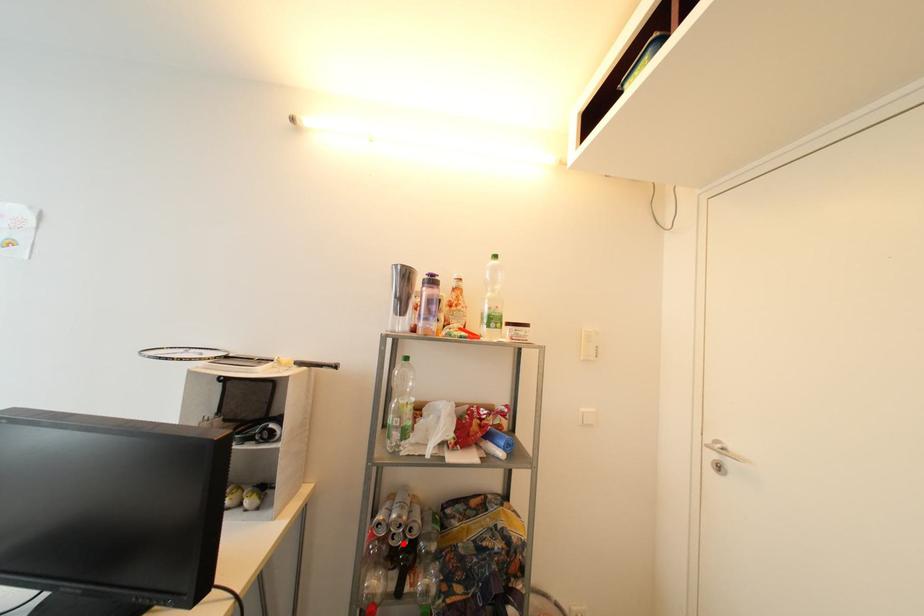
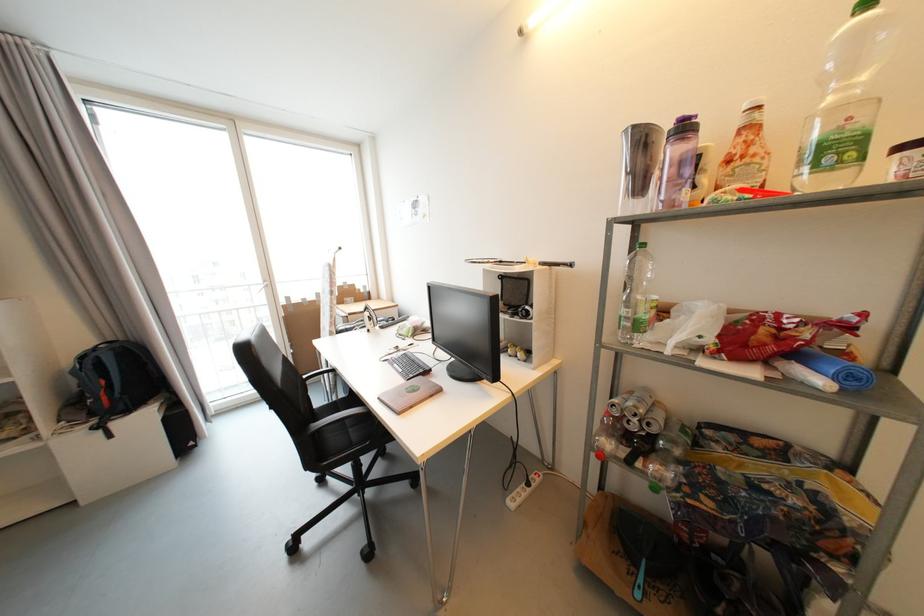
The point at the highlighted location is marked in the first image. Where is the corresponding point in the second image?

(638, 430)